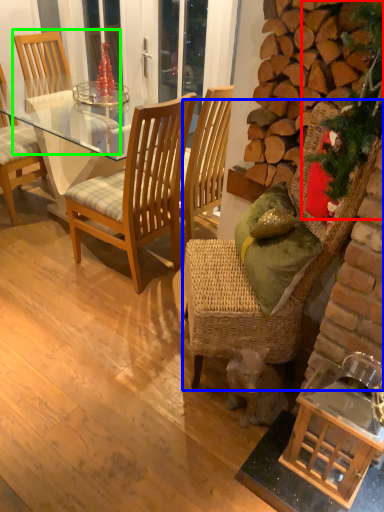
Question: Which object is positioned farthest from christmas decoration (highlighted by a red box)? Select from chair (highlighted by a blue box) and chair (highlighted by a green box).

Choices:
 (A) chair
 (B) chair

Answer: (B)